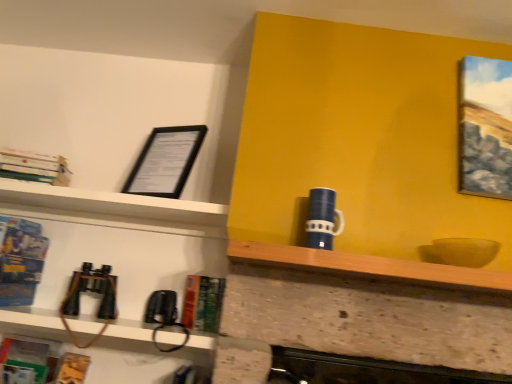
Question: Can you confirm if blue glossy book at left, which is the second book in top-to-bottom order, is wider than hardcover book at lower left, acting as the 4th book starting from the top?

Choices:
 (A) no
 (B) yes

Answer: (B)

Question: Does blue glossy book at left, the fourth book in the right-to-left sequence, have a greater height compared to hardcover book at lower left, which appears as the third book when viewed from the right?

Choices:
 (A) no
 (B) yes

Answer: (A)

Question: Is blue glossy book at left, which ranks as the first book in left-to-right order, located outside hardcover book at lower left, which appears as the third book when viewed from the right?

Choices:
 (A) no
 (B) yes

Answer: (B)

Question: Can you confirm if blue glossy book at left, which is the second book in top-to-bottom order, is bigger than hardcover book at lower left, marked as the 1th book in a bottom-to-top arrangement?

Choices:
 (A) no
 (B) yes

Answer: (B)

Question: Is the position of blue glossy book at left, which is the second book in top-to-bottom order, less distant than that of hardcover book at lower left, marked as the 1th book in a bottom-to-top arrangement?

Choices:
 (A) yes
 (B) no

Answer: (A)

Question: Is blue glossy book at left, which is the second book in top-to-bottom order, next to hardcover book at lower left, acting as the 4th book starting from the top, and touching it?

Choices:
 (A) no
 (B) yes

Answer: (A)

Question: Is wooden at center thinner than blue glossy mug at upper center?

Choices:
 (A) no
 (B) yes

Answer: (A)

Question: Can you confirm if wooden at center is smaller than blue glossy mug at upper center?

Choices:
 (A) no
 (B) yes

Answer: (A)

Question: Is wooden at center at the right side of blue glossy mug at upper center?

Choices:
 (A) no
 (B) yes

Answer: (B)

Question: Does wooden at center turn towards blue glossy mug at upper center?

Choices:
 (A) yes
 (B) no

Answer: (B)

Question: From the image's perspective, is wooden at center below blue glossy mug at upper center?

Choices:
 (A) no
 (B) yes

Answer: (B)

Question: Is wooden at center closer to camera compared to blue glossy mug at upper center?

Choices:
 (A) no
 (B) yes

Answer: (B)

Question: Is hardcover book at center, which is counted as the first book, starting from the right, not near wooden at center?

Choices:
 (A) yes
 (B) no

Answer: (B)